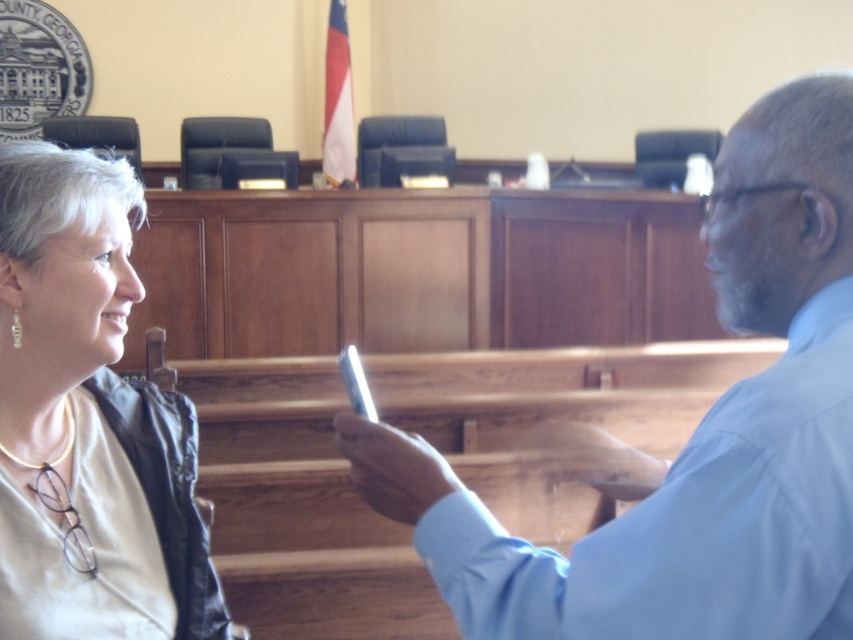
Which is below, light blue shirt at center or matte black jacket at left?

Positioned lower is matte black jacket at left.

The width and height of the screenshot is (853, 640). I want to click on light blue shirt at center, so click(x=694, y=435).

Find the location of `light blue shirt at center`. light blue shirt at center is located at coordinates (694, 435).